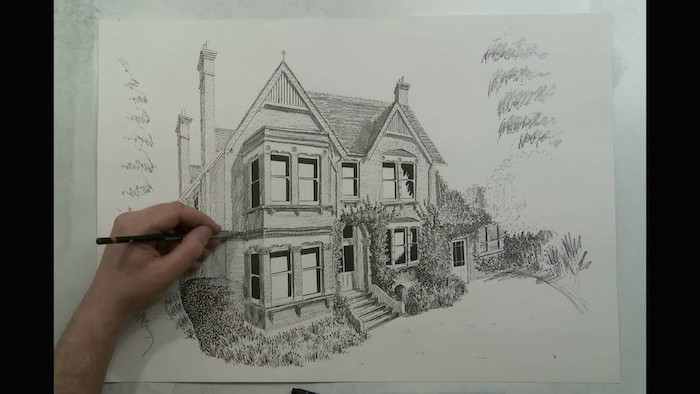
You are a GUI agent. You are given a task and a screenshot of the screen. Output one action in this format:
    pyautogui.click(x=<x>, y=<y>)
    Task: Click on the chimney
    The width and height of the screenshot is (700, 394).
    Given the screenshot: What is the action you would take?
    (218, 103), (192, 141), (396, 97)